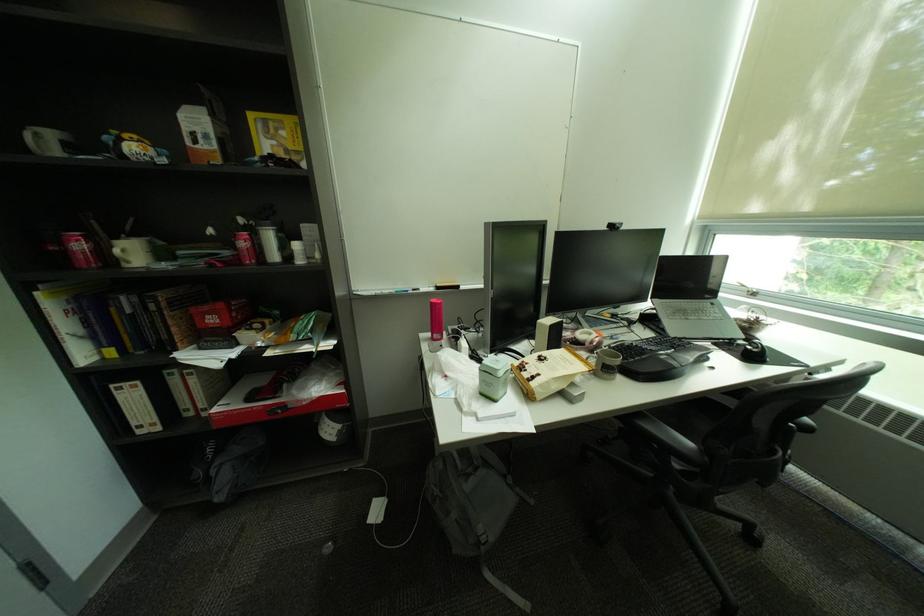
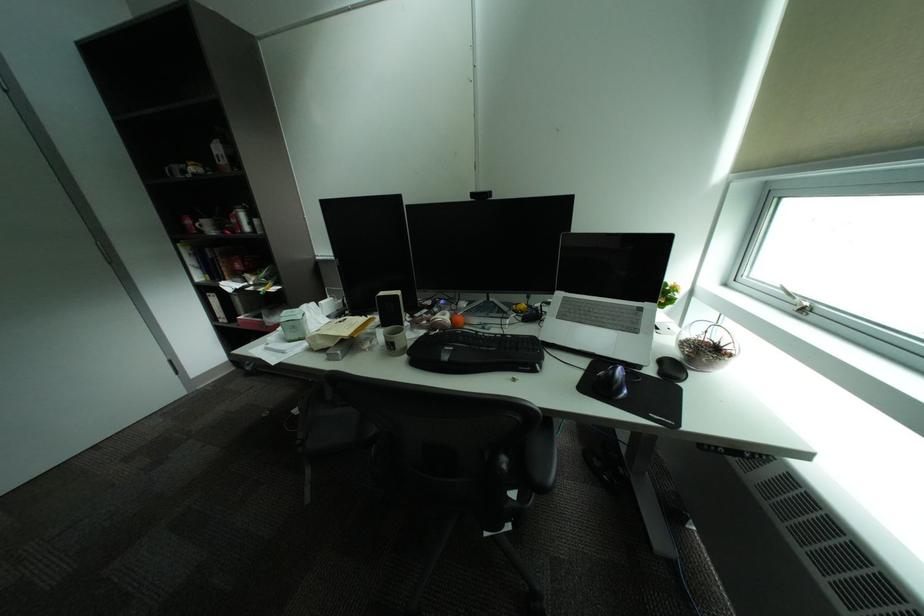
Locate, in the second image, the point that corresponds to (x=310, y=402) in the first image.

(281, 323)